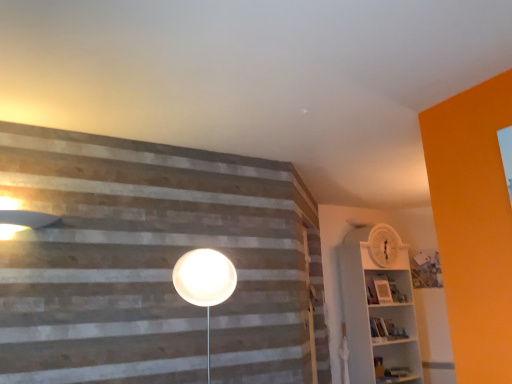
Question: In the image, is white plastic shelf at right on the left side or the right side of matte white lampshade at upper left?

Choices:
 (A) right
 (B) left

Answer: (A)

Question: Is white plastic shelf at right spatially inside matte white lampshade at upper left, or outside of it?

Choices:
 (A) inside
 (B) outside

Answer: (B)

Question: Estimate the real-world distances between objects in this image. Which object is farther from the white plastic shelf at right?

Choices:
 (A) matte white lampshade at upper left
 (B) white matte barn door at center

Answer: (A)

Question: Which is farther from the white matte barn door at center?

Choices:
 (A) white plastic shelf at right
 (B) matte white lampshade at upper left

Answer: (B)